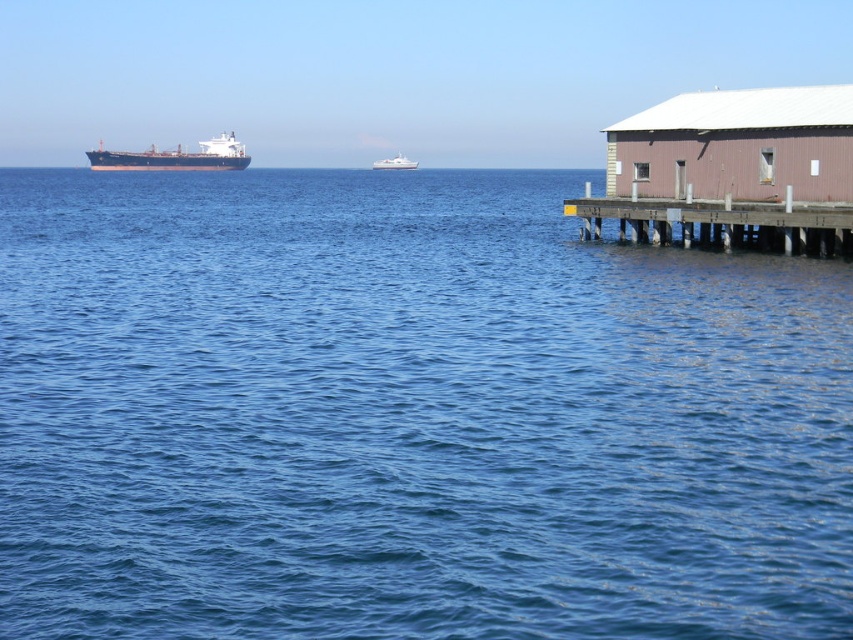
Question: Which of the following is the closest to the observer?

Choices:
 (A) (595, 212)
 (B) (447, 216)

Answer: (A)

Question: Which is farther from the white glossy boat at center?

Choices:
 (A) brown wooden dock at right
 (B) pink wood hut at right

Answer: (A)

Question: Can you confirm if brown wooden dock at right is positioned to the right of matte black ship at left?

Choices:
 (A) no
 (B) yes

Answer: (B)

Question: Does blue water at center have a larger size compared to white glossy boat at center?

Choices:
 (A) no
 (B) yes

Answer: (B)

Question: Which object is the farthest from the white glossy boat at center?

Choices:
 (A) brown wooden dock at right
 (B) matte black ship at left
 (C) blue water at center

Answer: (A)

Question: Can you confirm if blue water at center is positioned to the left of white glossy boat at center?

Choices:
 (A) no
 (B) yes

Answer: (A)